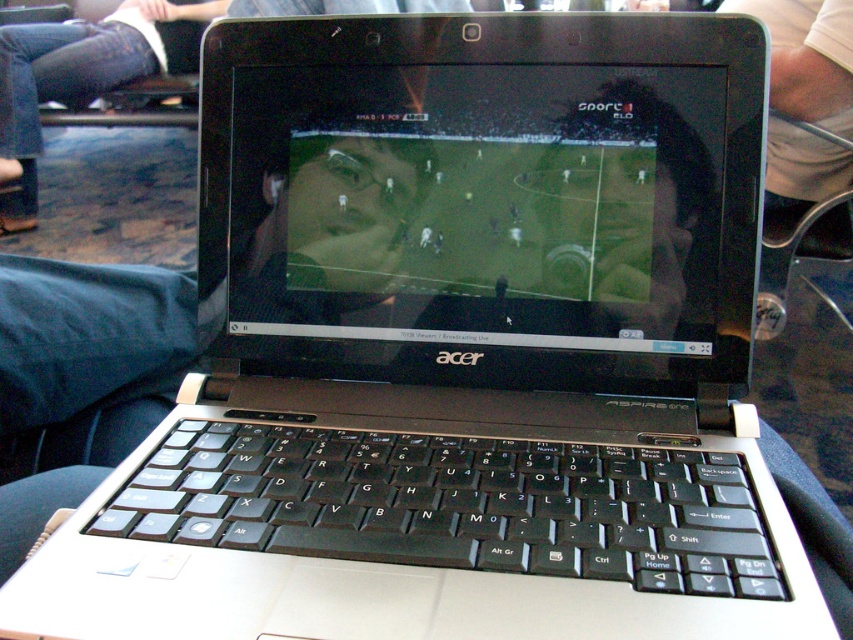
You are sitting next to someone on a train and notice their belongings. You see a matte black laptop at center and blue jeans at lower left. Which item is positioned more to the right side?

The matte black laptop at center is positioned to the right of the blue jeans at lower left, so the laptop is more to the right side.

You are traveling on a train and want to place your matte black laptop at center on top of your blue jeans at lower left to use the laptop. Will the laptop fit entirely on the jeans?

The matte black laptop at center is smaller than blue jeans at lower left, so it will fit entirely on the jeans.